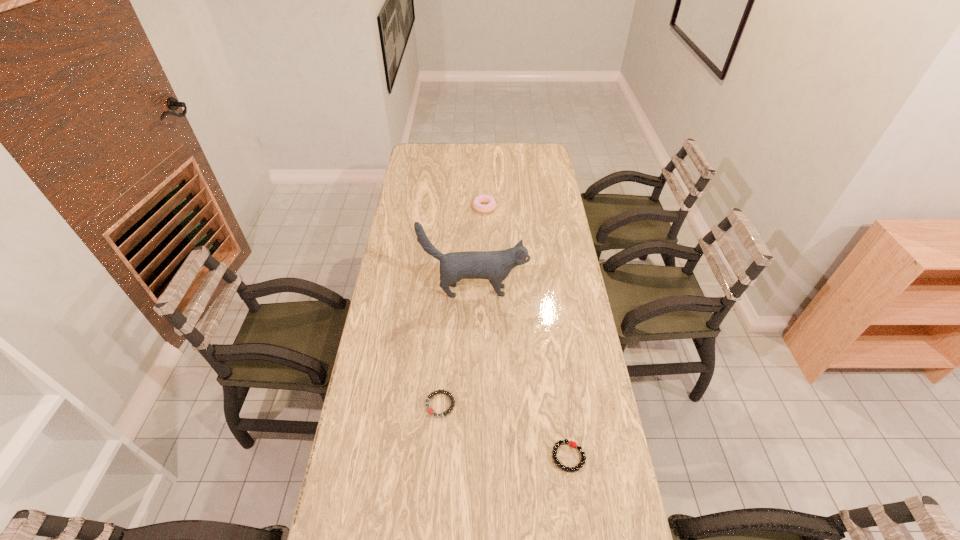
Image resolution: width=960 pixels, height=540 pixels. In order to click on vacant space located 0.090m on the front of the rightmost object in this screenshot , I will do `click(576, 509)`.

In order to click on free region located 0.070m on the left of the farther bracelet in this screenshot , I will do `click(402, 404)`.

Identify the location of object that is at the right edge. The height and width of the screenshot is (540, 960). (572, 444).

In the image, there is a desktop. Where is `vacant space at the far edge`? The width and height of the screenshot is (960, 540). vacant space at the far edge is located at coordinates (508, 148).

In the image, there is a desktop. In order to click on vacant space at the left edge in this screenshot , I will do `click(413, 249)`.

Where is `vacant space at the right edge of the desktop`? Image resolution: width=960 pixels, height=540 pixels. vacant space at the right edge of the desktop is located at coordinates (529, 218).

Locate an element on the screen. The width and height of the screenshot is (960, 540). vacant region at the far right corner is located at coordinates (527, 160).

Locate an element on the screen. Image resolution: width=960 pixels, height=540 pixels. vacant point located between the nearer bracelet and the tallest object is located at coordinates (521, 374).

Identify the location of vacant point located between the tallest object and the rightmost object. (521, 374).

Where is `free space between the farther bracelet and the nearest object`? Image resolution: width=960 pixels, height=540 pixels. free space between the farther bracelet and the nearest object is located at coordinates (504, 430).